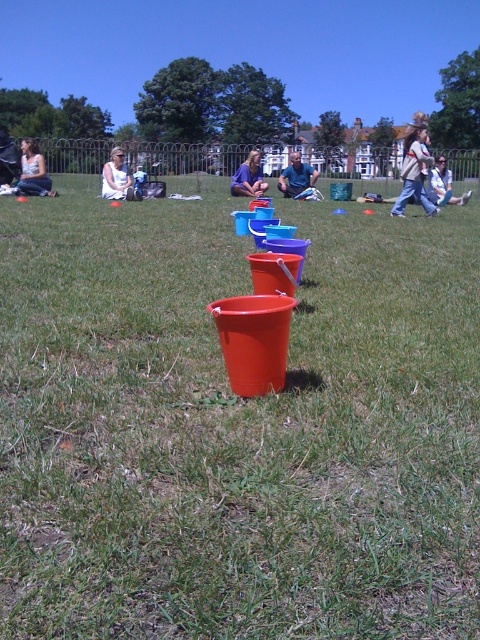
Question: Is green grass at center above light blue denim jacket at upper right?

Choices:
 (A) no
 (B) yes

Answer: (A)

Question: Which point appears farthest from the camera in this image?

Choices:
 (A) (27, 161)
 (B) (439, 182)
 (C) (296, 193)
 (D) (239, 182)

Answer: (C)

Question: Does white cotton shirt at center appear on the left side of light blue denim jacket at upper right?

Choices:
 (A) no
 (B) yes

Answer: (B)

Question: Among these objects, which one is farthest from the camera?

Choices:
 (A) blue fabric person at center
 (B) light blue denim jacket at upper right
 (C) green grass at center

Answer: (A)

Question: Which object is the farthest from the light blue denim jacket at upper right?

Choices:
 (A) denim jacket at upper center
 (B) blue fabric person at center
 (C) matte white shirt at left

Answer: (C)

Question: Can you confirm if white cotton shirt at center is positioned to the right of purple fabric at center?

Choices:
 (A) no
 (B) yes

Answer: (A)